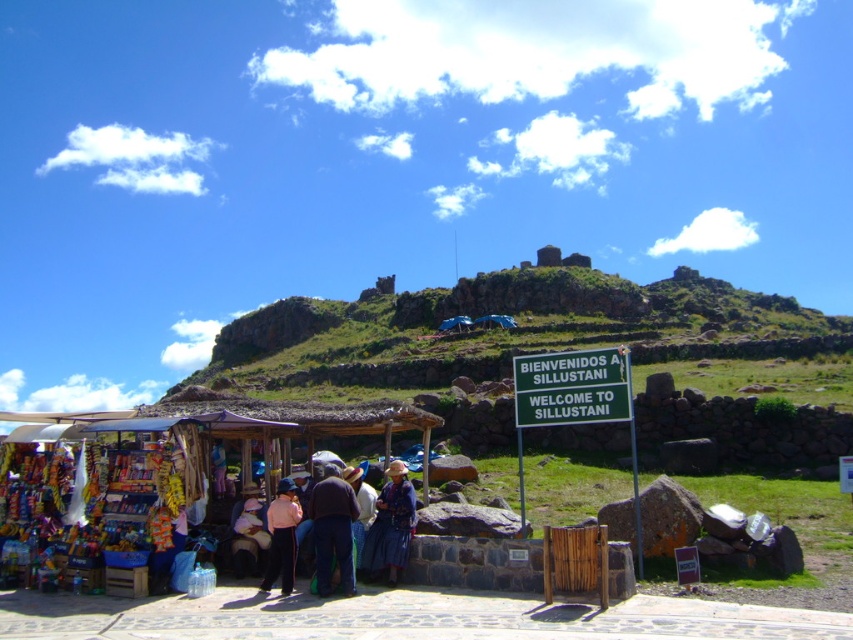
You are a tourist standing at the entrance of Sillustani and want to buy a souvenir. You see the wooden stall at lower left and the blue woven hat at center. Which object is closer to you?

The wooden stall at lower left is closer to you because it is further to the viewer than the blue woven hat at center.

You are standing at the market stall in Sillustani and want to take a photo that includes both the signboard and the group of people. The signboard is at point (178, 400) and the group is at point (363, 499). Since you want both to be in focus, which point should you focus on to ensure both are clear?

You should focus on point (178, 400) because it is closer to the camera than point (363, 499). By focusing on the closer point, the depth of field will extend to cover the farther point, keeping both in focus.

You are a traveler trying to decide which item to purchase first at the market stall. The blue woven skirt at center and the matte pink shirt at center are both displayed on the same rack. Based on their sizes, which one would you estimate takes up more horizontal space on the rack?

The blue woven skirt at center might be wider than matte pink shirt at center, so it likely takes up more horizontal space on the rack.